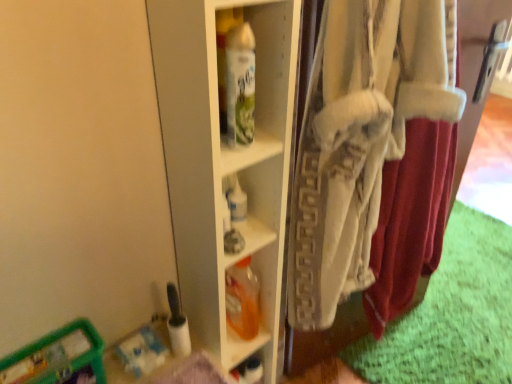
Question: Which direction should I rotate to look at translucent orange plastic bottle at center, acting as the first bottle starting from the bottom, — up or down?

Choices:
 (A) down
 (B) up

Answer: (A)

Question: Is translucent orange plastic bottle at center, acting as the first bottle starting from the bottom, at the back of white glossy shelf at center?

Choices:
 (A) no
 (B) yes

Answer: (B)

Question: Could translucent orange plastic bottle at center, which ranks as the second bottle in front-to-back order, be considered to be inside white glossy shelf at center?

Choices:
 (A) yes
 (B) no

Answer: (A)

Question: From a real-world perspective, does white glossy shelf at center stand above translucent orange plastic bottle at center, the 2th bottle positioned from the top?

Choices:
 (A) yes
 (B) no

Answer: (A)

Question: Does white glossy shelf at center have a smaller size compared to translucent orange plastic bottle at center, acting as the first bottle starting from the bottom?

Choices:
 (A) yes
 (B) no

Answer: (B)

Question: Is white glossy shelf at center next to translucent orange plastic bottle at center, acting as the first bottle starting from the bottom?

Choices:
 (A) yes
 (B) no

Answer: (B)

Question: From the image's perspective, does white glossy shelf at center appear higher than translucent orange plastic bottle at center, acting as the first bottle starting from the bottom?

Choices:
 (A) yes
 (B) no

Answer: (A)

Question: From the image's perspective, is translucent orange plastic bottle at center, the 1th bottle when ordered from back to front, on white glossy spray can at center, placed as the 1th bottle when sorted from front to back?

Choices:
 (A) no
 (B) yes

Answer: (A)

Question: Is translucent orange plastic bottle at center, acting as the first bottle starting from the bottom, facing away from white glossy spray can at center, the 2th bottle in the back-to-front sequence?

Choices:
 (A) yes
 (B) no

Answer: (B)

Question: From a real-world perspective, is translucent orange plastic bottle at center, acting as the first bottle starting from the bottom, under white glossy spray can at center, the 2th bottle in the back-to-front sequence?

Choices:
 (A) no
 (B) yes

Answer: (B)

Question: Does translucent orange plastic bottle at center, the 2th bottle positioned from the top, have a smaller size compared to white glossy spray can at center, placed as the 1th bottle when sorted from top to bottom?

Choices:
 (A) yes
 (B) no

Answer: (B)

Question: From the image's perspective, is translucent orange plastic bottle at center, acting as the first bottle starting from the bottom, below white glossy spray can at center, placed as the 1th bottle when sorted from top to bottom?

Choices:
 (A) no
 (B) yes

Answer: (B)

Question: Is translucent orange plastic bottle at center, which ranks as the second bottle in front-to-back order, not inside white glossy spray can at center, placed as the 1th bottle when sorted from top to bottom?

Choices:
 (A) yes
 (B) no

Answer: (A)

Question: Can you confirm if white glossy shelf at center is positioned to the left of white cotton underclothes at right?

Choices:
 (A) no
 (B) yes

Answer: (B)